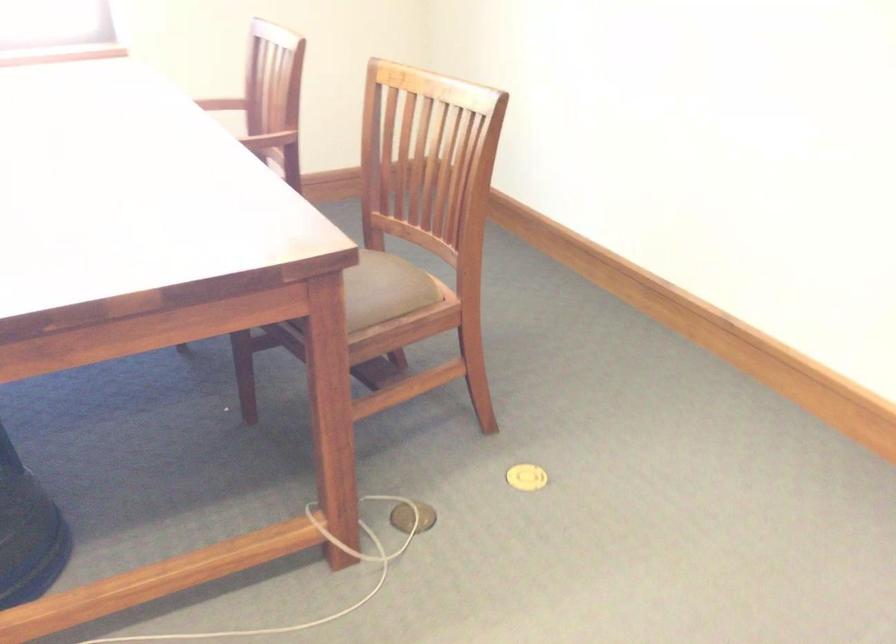
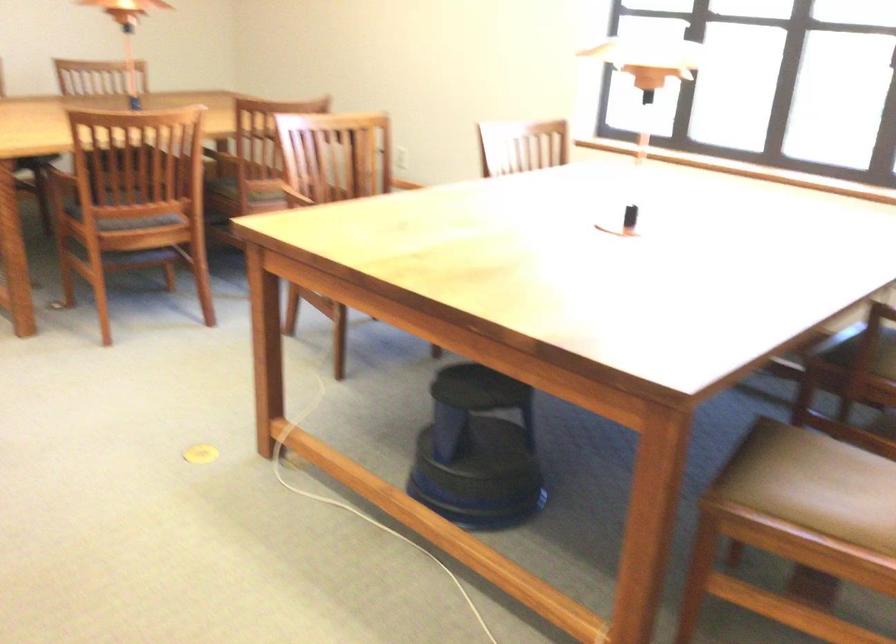
Question: The camera is either moving clockwise (left) or counter-clockwise (right) around the object. The first image is from the beginning of the video and the second image is from the end. Is the camera moving left or right when shooting the video?

Choices:
 (A) Left
 (B) Right

Answer: (B)